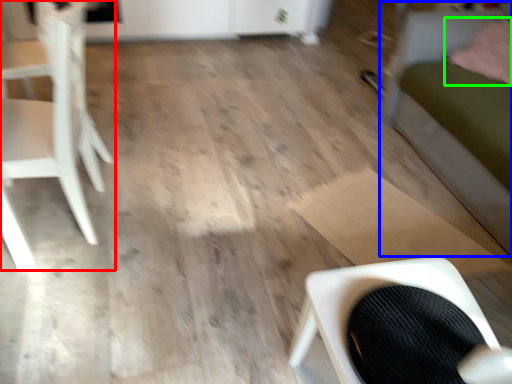
Question: Considering the real-world distances, which object is farthest from chair (highlighted by a red box)? bed (highlighted by a blue box) or pillow (highlighted by a green box)?

Choices:
 (A) bed
 (B) pillow

Answer: (B)